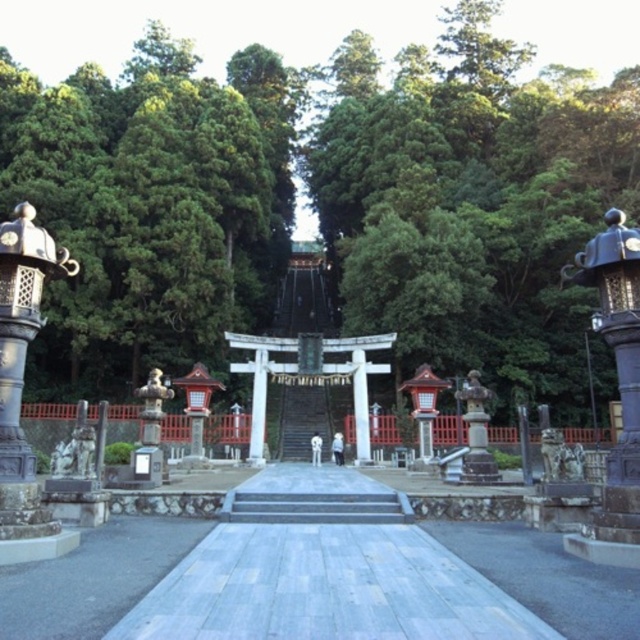
Does polished bronze lantern at right appear on the right side of wooden stairs at center?

Indeed, polished bronze lantern at right is positioned on the right side of wooden stairs at center.

Is polished bronze lantern at right below wooden stairs at center?

Incorrect, polished bronze lantern at right is not positioned below wooden stairs at center.

Where is `polished bronze lantern at right`? polished bronze lantern at right is located at coordinates (616, 326).

Is green leafy tree at center positioned behind wooden stairs at center?

Yes, green leafy tree at center is behind wooden stairs at center.

The image size is (640, 640). What do you see at coordinates (324, 204) in the screenshot?
I see `green leafy tree at center` at bounding box center [324, 204].

Locate an element on the screen. green leafy tree at center is located at coordinates click(324, 204).

Which of these two, green leafy tree at upper center or polished bronze lantern at right, stands shorter?

Standing shorter between the two is polished bronze lantern at right.

Between green leafy tree at upper center and polished bronze lantern at right, which one has more height?

green leafy tree at upper center is taller.

Who is more distant from viewer, (218, 138) or (636, 456)?

The point (218, 138) is more distant.

This screenshot has width=640, height=640. I want to click on green leafy tree at upper center, so click(x=150, y=208).